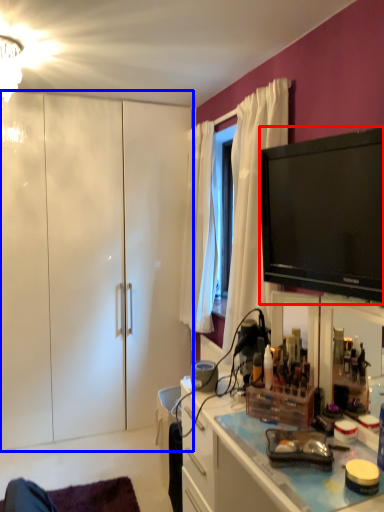
Question: Which object appears farthest to the camera in this image, television (highlighted by a red box) or cabinetry (highlighted by a blue box)?

Choices:
 (A) television
 (B) cabinetry

Answer: (B)